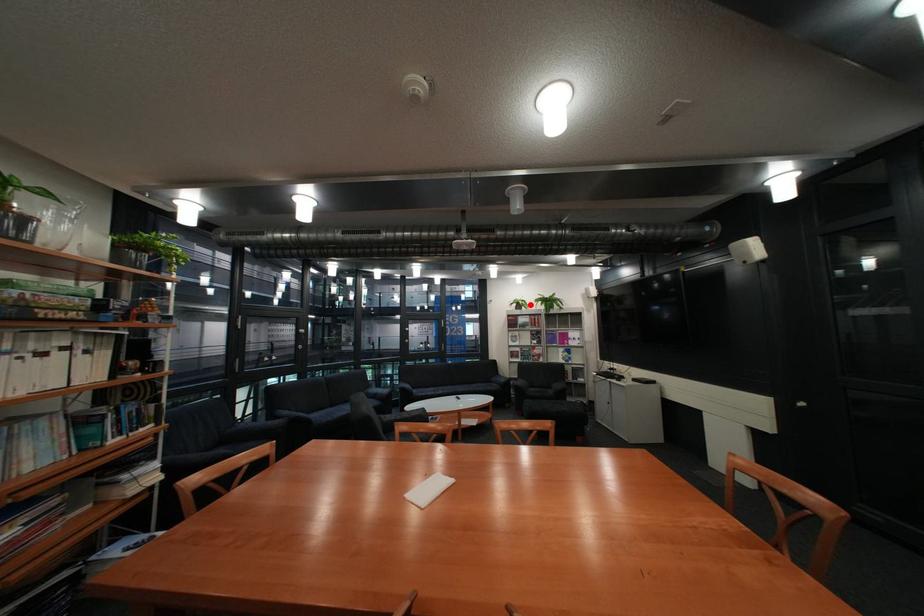
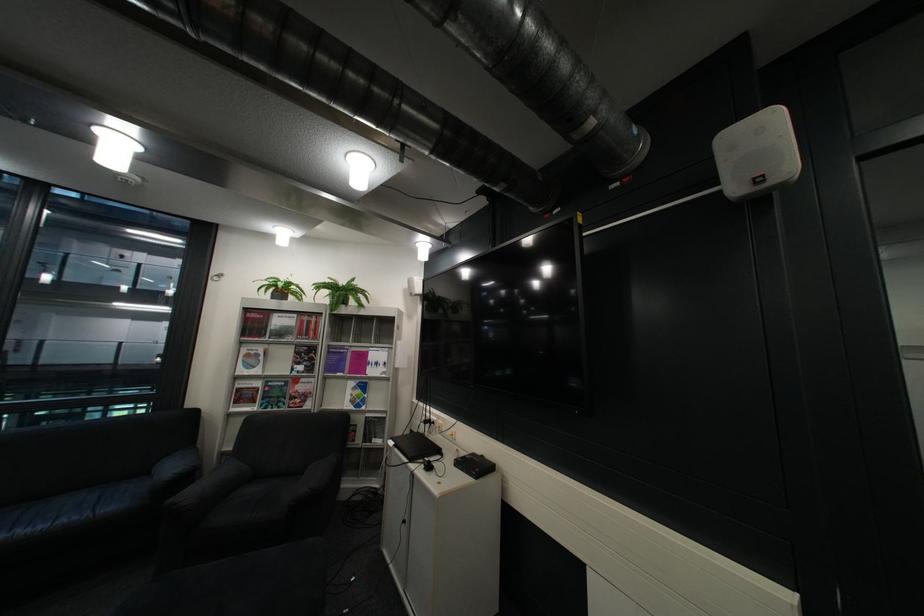
In the second image, find the point that corresponds to the highlighted location in the first image.

(287, 290)